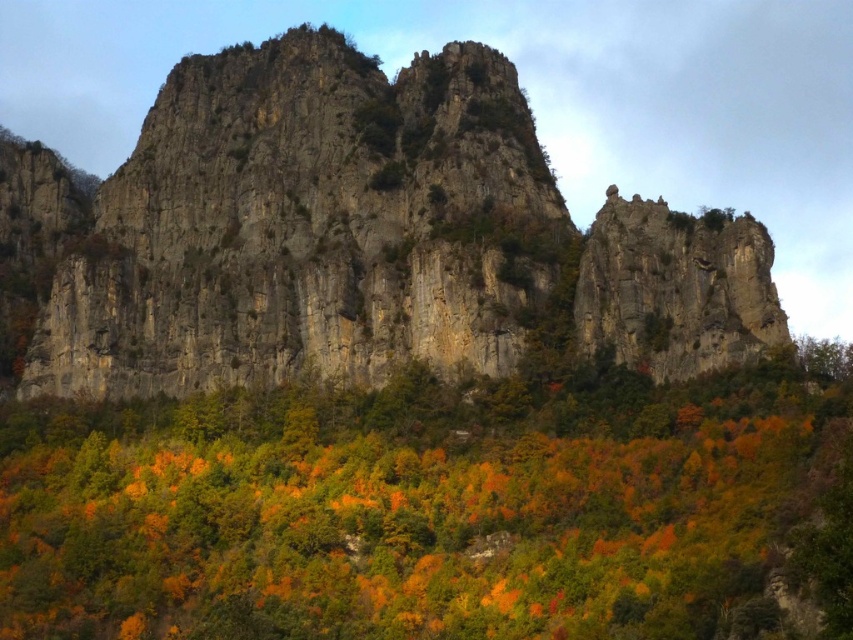
Question: Is orange matte tree at center to the right of rocky cliff at center from the viewer's perspective?

Choices:
 (A) no
 (B) yes

Answer: (A)

Question: Considering the relative positions of orange matte tree at center and rocky cliff at center in the image provided, where is orange matte tree at center located with respect to rocky cliff at center?

Choices:
 (A) below
 (B) above

Answer: (A)

Question: Which object is closer to the camera taking this photo?

Choices:
 (A) rocky cliff at center
 (B) orange matte tree at center

Answer: (B)

Question: Is the position of orange matte tree at center more distant than that of rocky cliff at center?

Choices:
 (A) yes
 (B) no

Answer: (B)